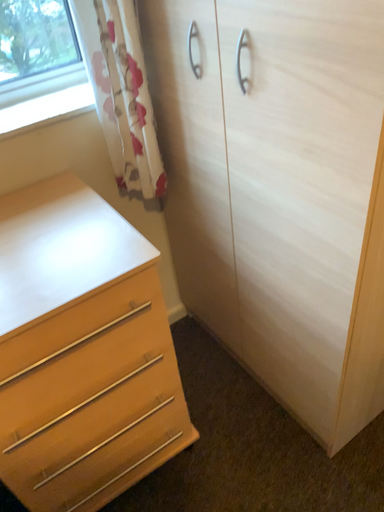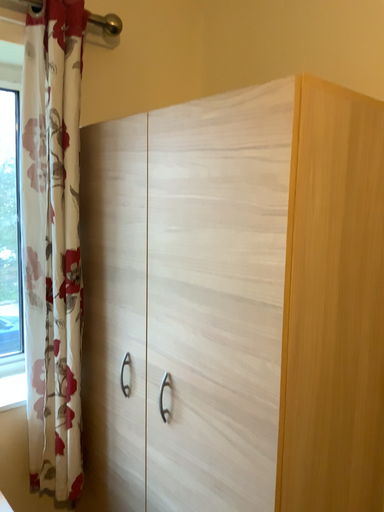
Question: How did the camera likely rotate when shooting the video?

Choices:
 (A) rotated right
 (B) rotated left

Answer: (A)